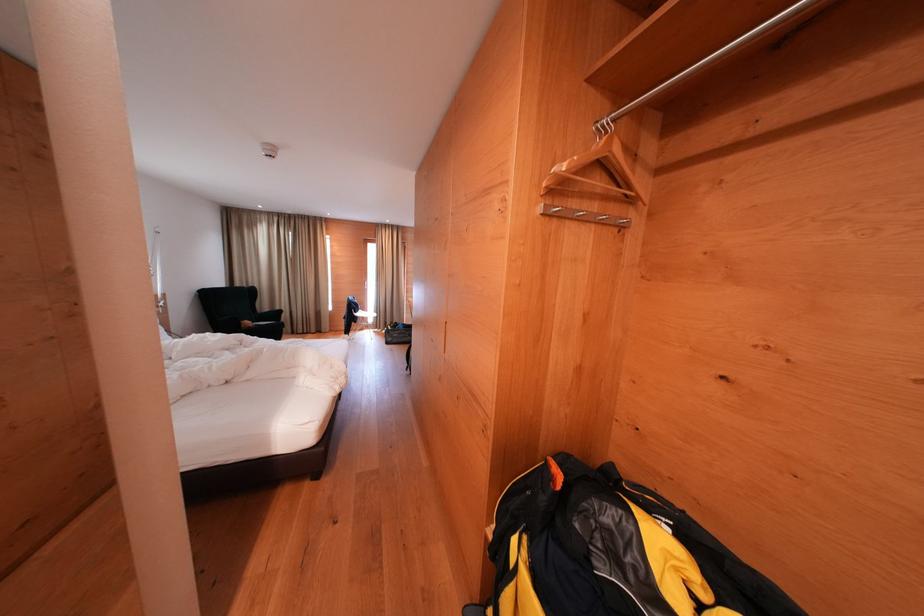
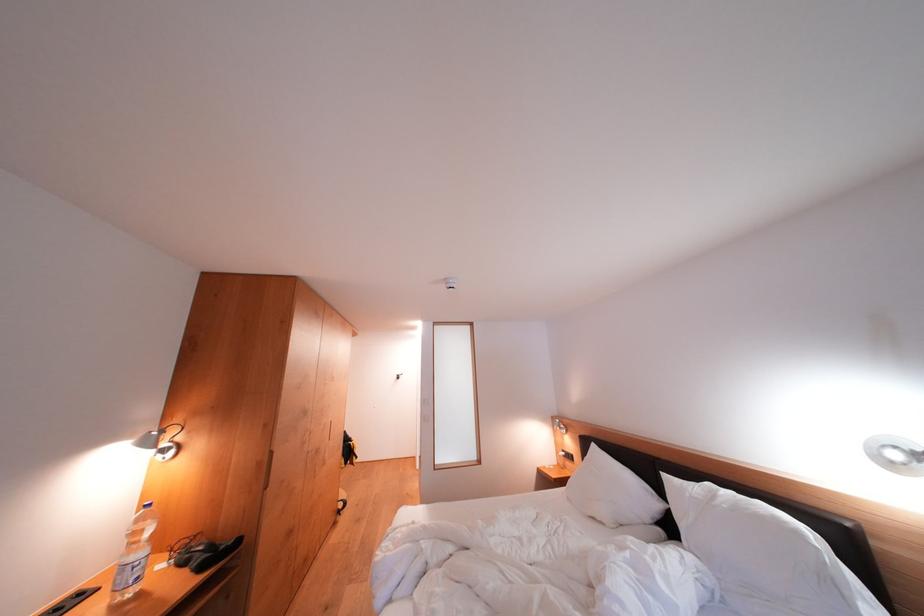
Question: I am providing you with two images of the same scene from different viewpoints. After the viewpoint changes to image2, which objects are now occluded?

Choices:
 (A) metal closet rod
 (B) headboard light switch
 (C) white pillow
 (D) black telephone handset

Answer: (A)